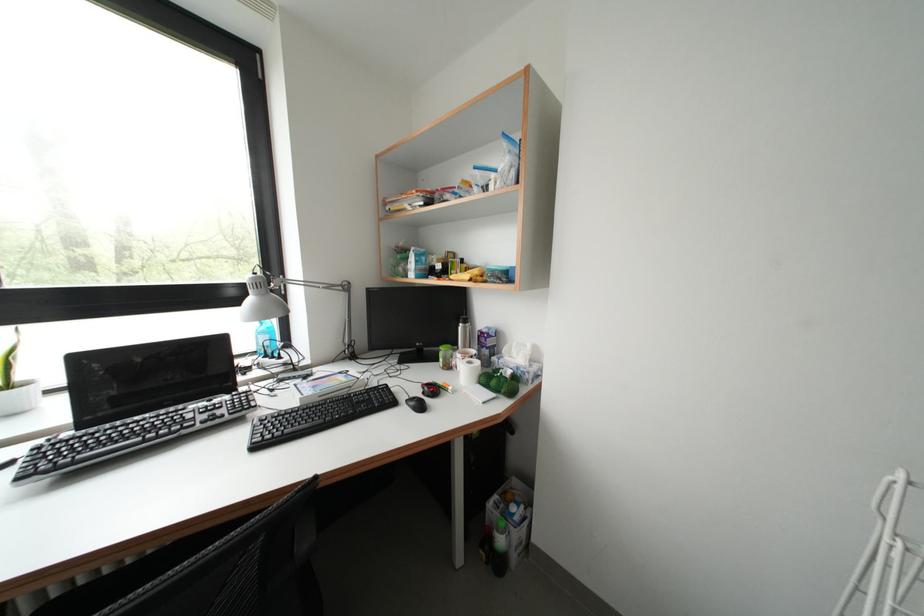
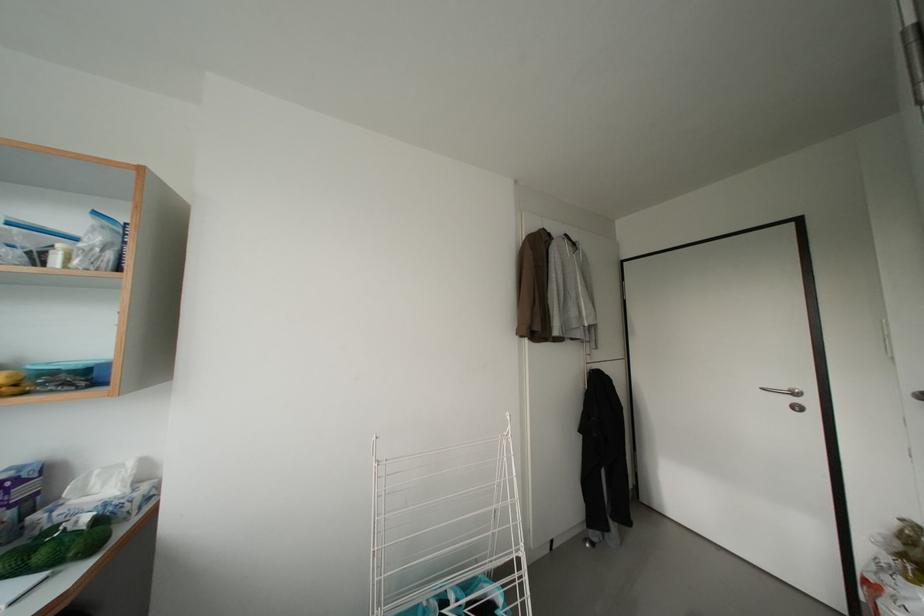
Find the pixel in the second image that matches (512,274) in the first image.

(88, 371)